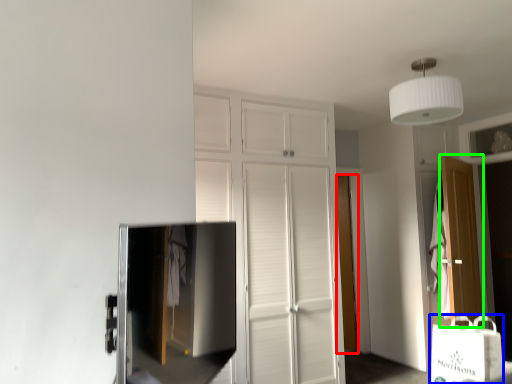
Question: Based on their relative distances, which object is farther from door (highlighted by a red box)? Choose from shopping bag (highlighted by a blue box) and door (highlighted by a green box).

Choices:
 (A) shopping bag
 (B) door

Answer: (A)